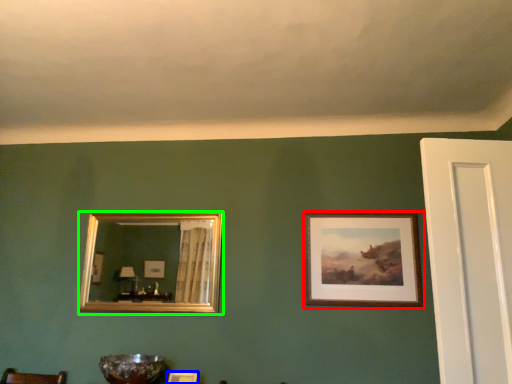
Question: Which is nearer to the picture frame (highlighted by a red box)? picture frame (highlighted by a blue box) or picture frame (highlighted by a green box).

Choices:
 (A) picture frame
 (B) picture frame

Answer: (A)